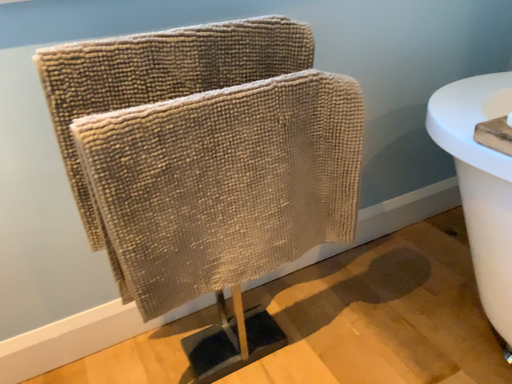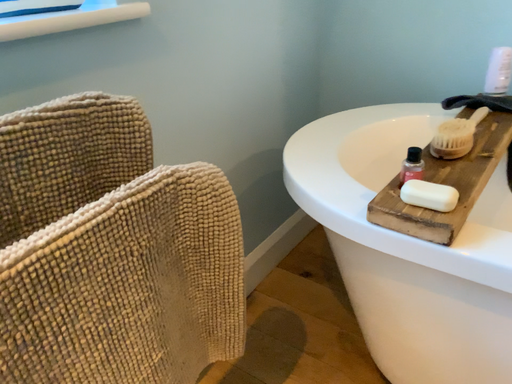
Question: Which way did the camera rotate in the video?

Choices:
 (A) rotated right
 (B) rotated left

Answer: (A)